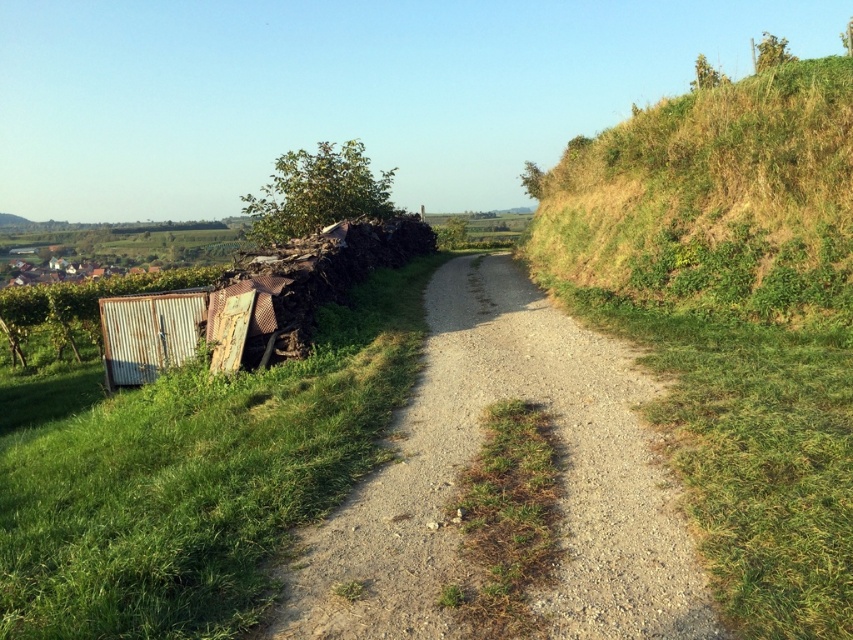
Question: Which point is closer to the camera?

Choices:
 (A) green corrugated metal at left
 (B) gravelly dirt path at center
 (C) green grassy hillside at upper right

Answer: (B)

Question: Which point is closer to the camera?

Choices:
 (A) (850, 84)
 (B) (558, 376)

Answer: (B)

Question: Is green corrugated metal at left closer to camera compared to gravelly dirt path at center?

Choices:
 (A) yes
 (B) no

Answer: (B)

Question: Which object is closer to the camera taking this photo?

Choices:
 (A) green grassy hillside at upper right
 (B) green corrugated metal at left

Answer: (B)

Question: Is green corrugated metal at left positioned behind gravelly dirt path at center?

Choices:
 (A) yes
 (B) no

Answer: (A)

Question: In this image, where is gravelly dirt path at center located relative to green grassy hillside at upper right?

Choices:
 (A) left
 (B) right

Answer: (A)